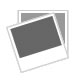
The image size is (80, 80). In order to click on photos in this screenshot , I will do `click(49, 38)`, `click(60, 22)`.